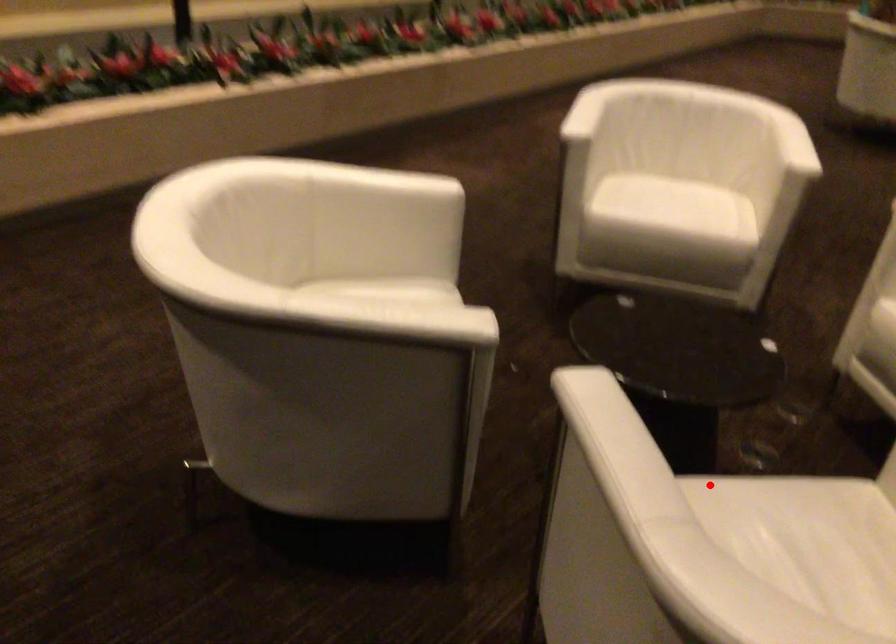
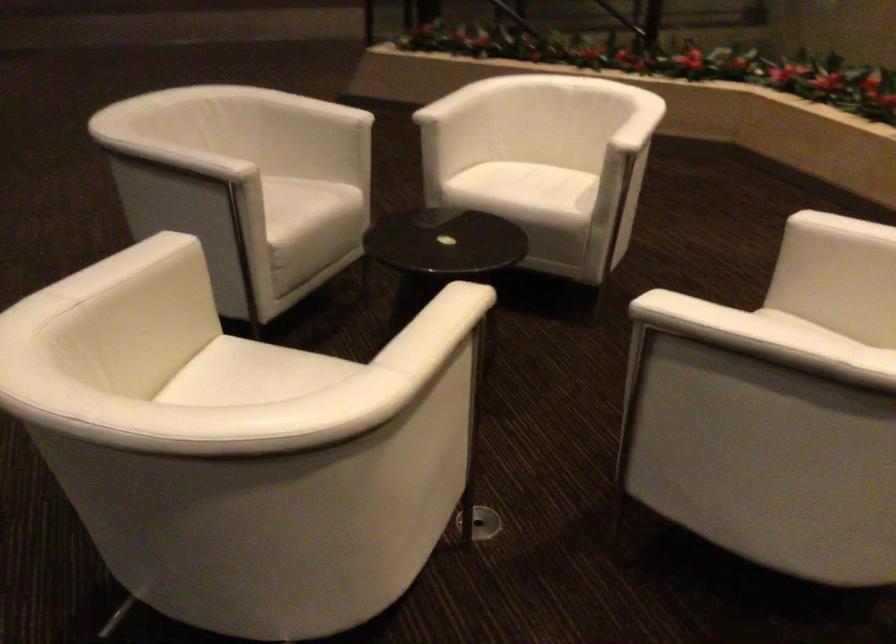
Locate, in the second image, the point that corresponds to the highlighted location in the first image.

(306, 205)